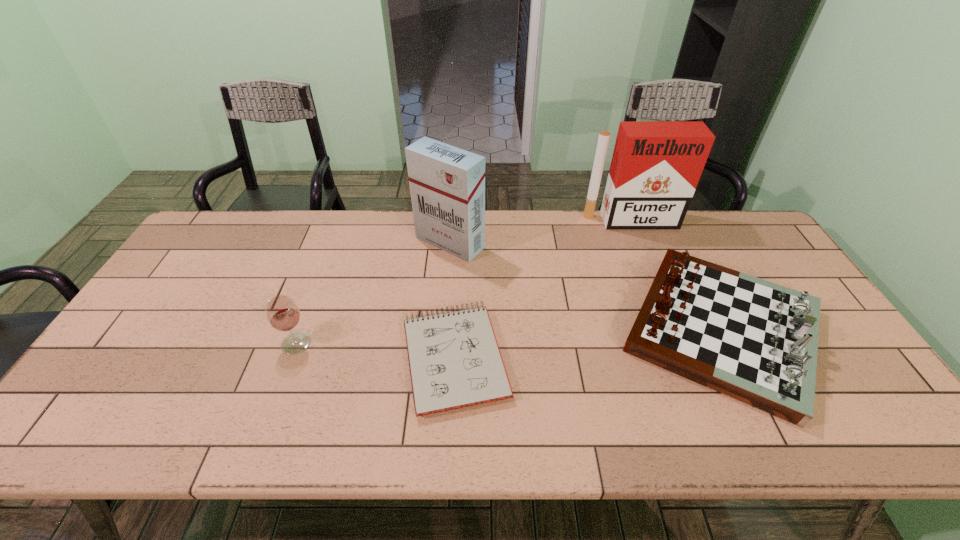
Where is `the right cigarette case`? The image size is (960, 540). the right cigarette case is located at coordinates (656, 165).

In order to click on the left cigarette case in this screenshot , I will do `click(447, 184)`.

At what (x,y) coordinates should I click in order to perform the action: click on the leftmost object. Please return your answer as a coordinate pair (x, y). This screenshot has height=540, width=960. Looking at the image, I should click on (282, 313).

Identify the location of wineglass. (282, 313).

Find the location of a particular element. Image resolution: width=960 pixels, height=540 pixels. the fourth tallest object is located at coordinates (755, 341).

This screenshot has width=960, height=540. In order to click on notepad in this screenshot , I will do `click(454, 359)`.

At what (x,y) coordinates should I click in order to perform the action: click on free space located 0.370m on the front-facing side of the right cigarette case. Please return your answer as a coordinate pair (x, y). This screenshot has height=540, width=960. Looking at the image, I should click on (667, 311).

This screenshot has height=540, width=960. In order to click on free space located on the front of the left cigarette case in this screenshot , I will do `click(442, 345)`.

In order to click on blank space located on the right of the leftmost object in this screenshot , I will do `click(438, 343)`.

Identify the location of free location located on the left of the second shortest object. (594, 330).